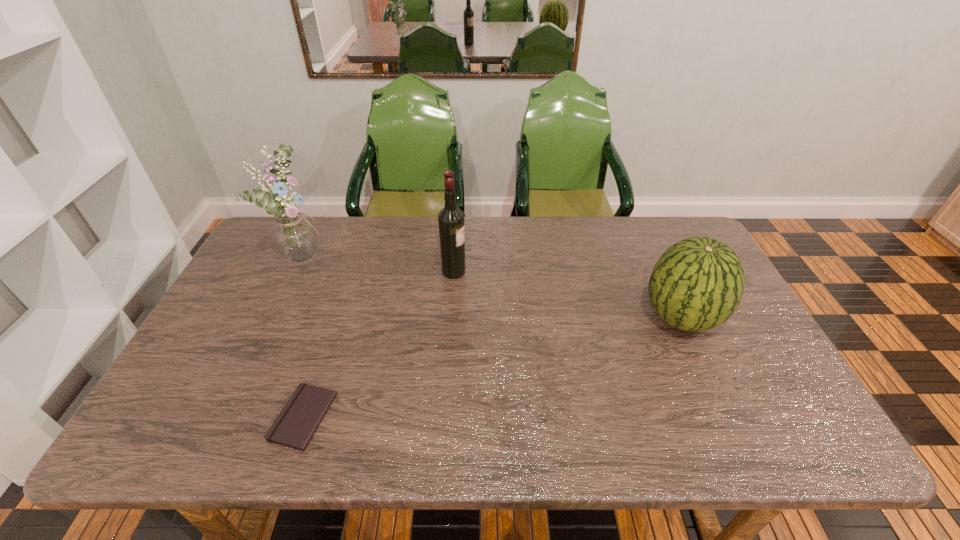
What are the coordinates of `vacant region between the shortest object and the wine bottle` in the screenshot? It's located at (378, 345).

Where is `free space between the second object from right to left and the second shortest object`? Image resolution: width=960 pixels, height=540 pixels. free space between the second object from right to left and the second shortest object is located at coordinates (567, 295).

The width and height of the screenshot is (960, 540). I want to click on free space between the nearest object and the third object from left to right, so click(x=378, y=345).

This screenshot has width=960, height=540. In order to click on unoccupied position between the third tallest object and the third object from right to left in this screenshot , I will do `click(492, 367)`.

At what (x,y) coordinates should I click in order to perform the action: click on unoccupied position between the leftmost object and the wine bottle. Please return your answer as a coordinate pair (x, y). This screenshot has height=540, width=960. Looking at the image, I should click on (379, 263).

The height and width of the screenshot is (540, 960). I want to click on vacant area between the third farthest object and the bouquet, so click(492, 286).

Where is `vacant area that lies between the third object from left to right and the bouquet`? vacant area that lies between the third object from left to right and the bouquet is located at coordinates (379, 263).

This screenshot has width=960, height=540. Identify the location of blank region between the leftmost object and the watermelon. (492, 286).

Locate an element on the screen. vacant point located between the shortest object and the leftmost object is located at coordinates (304, 336).

Locate an element on the screen. object that is the third closest to the second object from right to left is located at coordinates (697, 284).